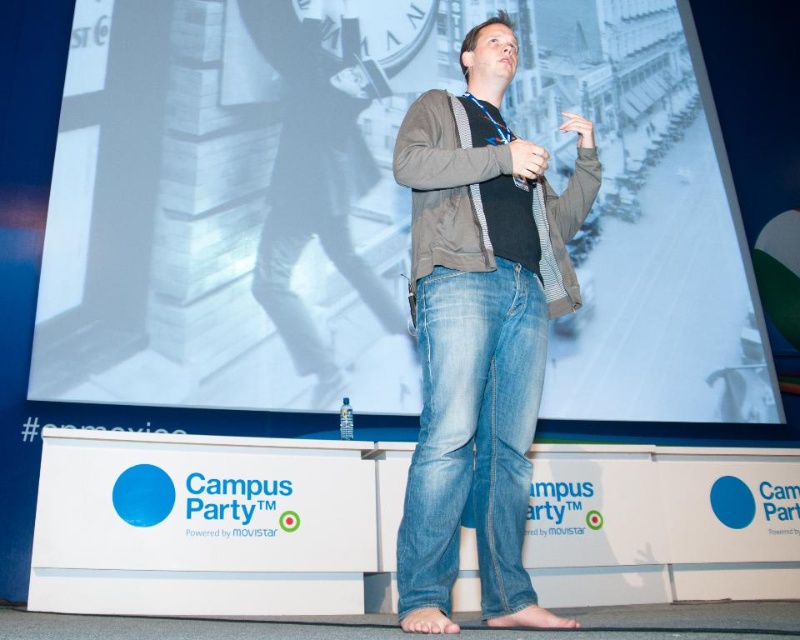
Question: Does white matte projection screen at upper center have a larger size compared to denim jeans at center?

Choices:
 (A) no
 (B) yes

Answer: (B)

Question: Where is white matte projection screen at upper center located in relation to denim jeans at center in the image?

Choices:
 (A) above
 (B) below

Answer: (A)

Question: Among these objects, which one is nearest to the camera?

Choices:
 (A) white matte projection screen at upper center
 (B) denim jeans at center

Answer: (B)

Question: Is white matte projection screen at upper center to the left of denim jeans at center from the viewer's perspective?

Choices:
 (A) no
 (B) yes

Answer: (A)

Question: Among these points, which one is nearest to the camera?

Choices:
 (A) (446, 204)
 (B) (698, 275)

Answer: (A)